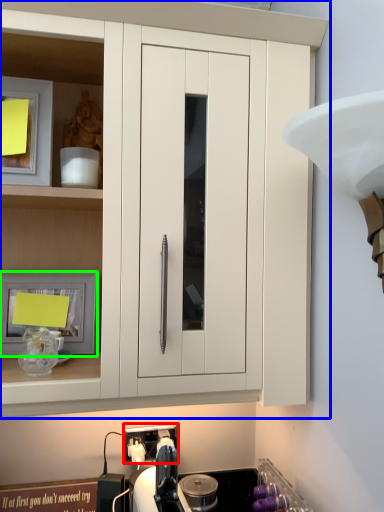
Question: Estimate the real-world distances between objects in this image. Which object is closer to electric outlet (highlighted by a red box), cabinetry (highlighted by a blue box) or picture frame (highlighted by a green box)?

Choices:
 (A) cabinetry
 (B) picture frame

Answer: (B)